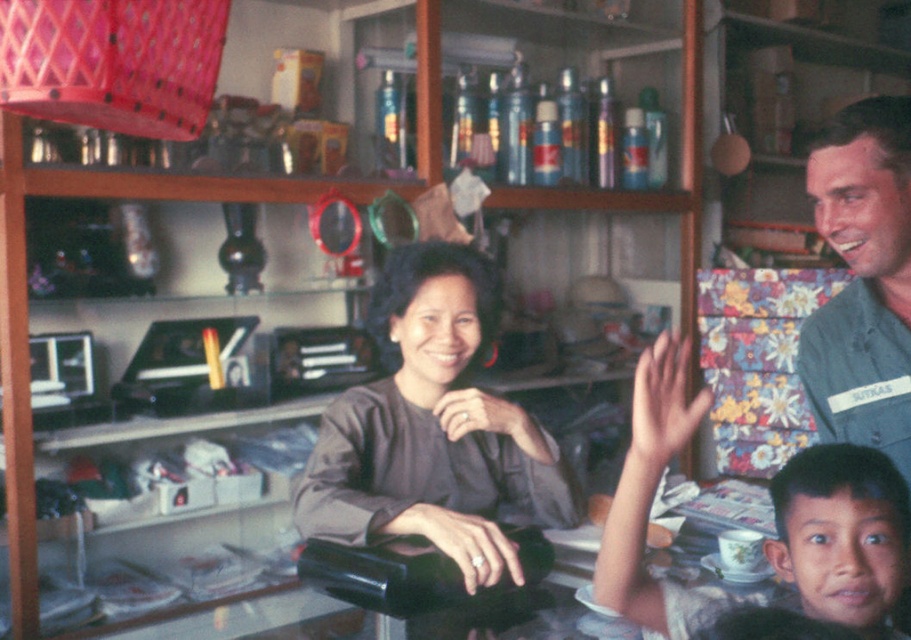
You are standing at the entrance of the store and want to approach the gray fabric shirt at center. Which direction should you move to reach it?

The gray fabric shirt at center is located at point 0.672 on the x axis and 0.476 on the y axis, so you should move towards the center of the store to reach it.

You are a customer in the store and want to ask the woman behind the counter a question. You notice the gray fabric shirt at center and the dark brown hair at lower right. Which object is closer to the left side of the store?

The gray fabric shirt at center is positioned on the left side of dark brown hair at lower right, so the gray fabric shirt at center is closer to the left side of the store.

You are a delivery person who needs to place a large package on the counter. The package is 1.2 meters wide. The counter is between the smooth skin child at center and the denim shirt at upper right. Can the package fit on the counter between them?

The smooth skin child at center might be wider than denim shirt at upper right, so the distance between them may be less than 1.2 meters. Therefore, the package might not fit.